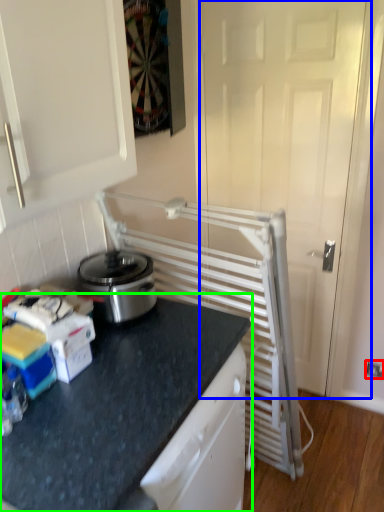
Question: Which is farther away from electric outlet (highlighted by a red box)? screen door (highlighted by a blue box) or countertop (highlighted by a green box)?

Choices:
 (A) screen door
 (B) countertop

Answer: (B)